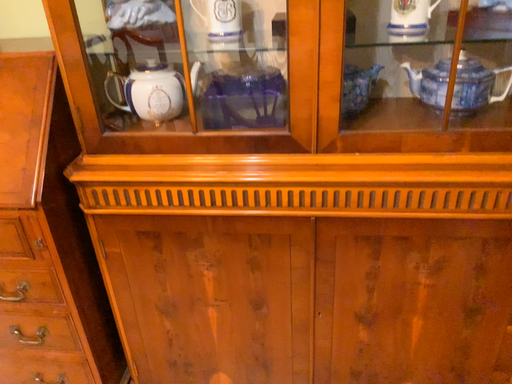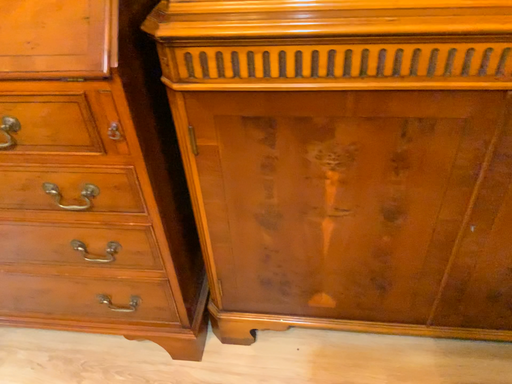
Question: How did the camera likely rotate when shooting the video?

Choices:
 (A) rotated upward
 (B) rotated downward

Answer: (B)